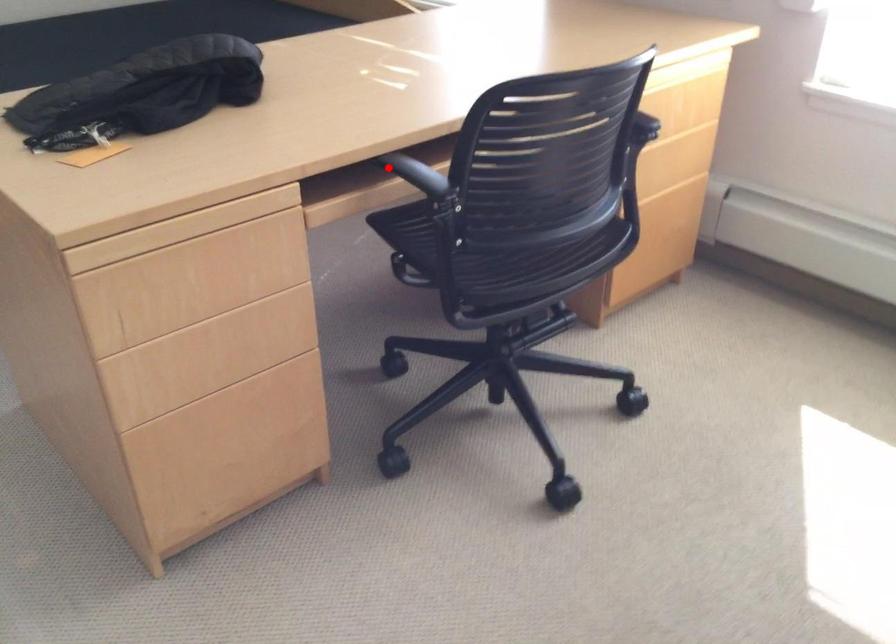
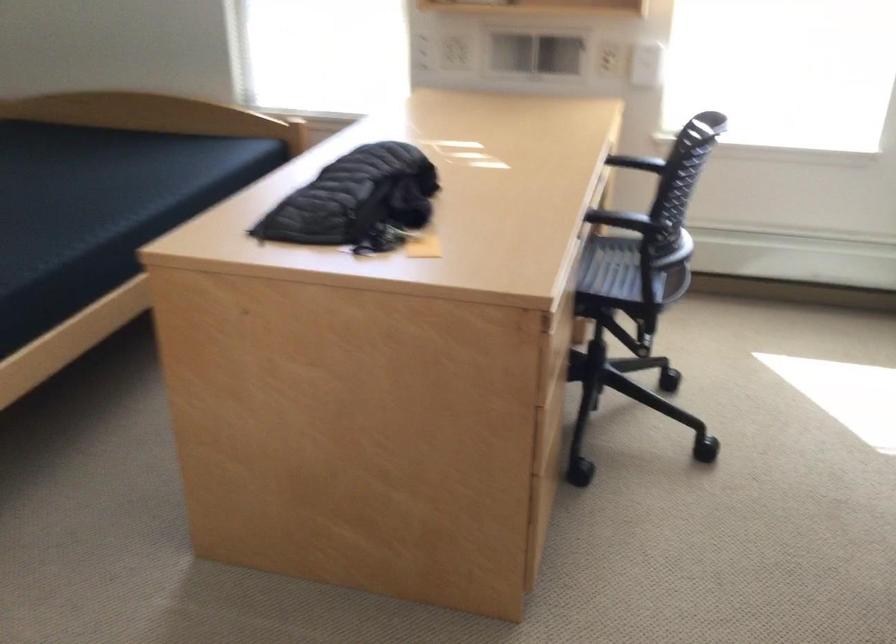
In the second image, find the point that corresponds to the highlighted location in the first image.

(597, 216)